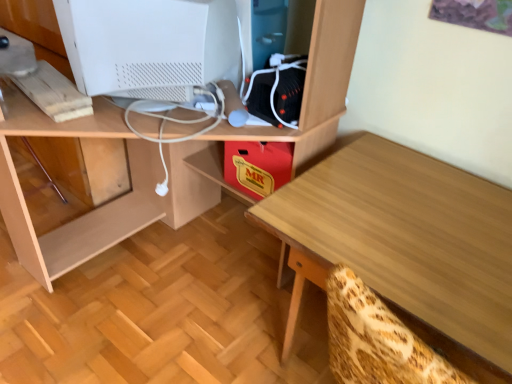
What is the approximate height of light wood table at center?

light wood table at center is 25.61 inches in height.

At what (x,y) coordinates should I click in order to perform the action: click on white matte computer monitor at upper left. Please return your answer as a coordinate pair (x, y). Looking at the image, I should click on (150, 45).

From the image's perspective, relative to light wood table at center, is white matte computer monitor at upper left above or below?

Clearly, from the image's perspective, white matte computer monitor at upper left is above light wood table at center.

Does white matte computer monitor at upper left turn towards light wood table at center?

No, white matte computer monitor at upper left does not turn towards light wood table at center.

How distant is white matte computer monitor at upper left from light wood table at center?

The distance of white matte computer monitor at upper left from light wood table at center is 60.47 centimeters.

In the scene shown: Would you consider white matte computer monitor at upper left to be distant from light wood table at center?

white matte computer monitor at upper left is near light wood table at center, not far away.

How distant is wooden desk at center from white matte computer monitor at upper left?

wooden desk at center is 12.06 inches from white matte computer monitor at upper left.

Consider the image. From the image's perspective, is wooden desk at center above or below white matte computer monitor at upper left?

Clearly, from the image's perspective, wooden desk at center is below white matte computer monitor at upper left.

Relative to white matte computer monitor at upper left, is wooden desk at center in front or behind?

Clearly, wooden desk at center is in front of white matte computer monitor at upper left.

From a real-world perspective, which is physically below, wooden desk at center or white matte computer monitor at upper left?

wooden desk at center, from a real-world perspective.

Which object is wider, light wood table at center or white matte computer monitor at upper left?

light wood table at center.

Is point (426, 340) closer or farther from the camera than point (68, 10)?

Point (426, 340).

In the scene shown: Looking at the image, does light wood table at center seem bigger or smaller compared to white matte computer monitor at upper left?

In the image, light wood table at center appears to be larger than white matte computer monitor at upper left.

What's the angular difference between light wood table at center and white matte computer monitor at upper left's facing directions?

They differ by 75.8 degrees in their facing directions.

From the image's perspective, is white matte computer monitor at upper left above wooden desk at center?

Yes, from the image's perspective, white matte computer monitor at upper left is on top of wooden desk at center.

The width and height of the screenshot is (512, 384). There is a wooden desk at center. Identify the location of computer monitor above it (from a real-world perspective). (150, 45).

Considering the sizes of objects white matte computer monitor at upper left and wooden desk at center in the image provided, who is bigger, white matte computer monitor at upper left or wooden desk at center?

With larger size is wooden desk at center.

Is point (156, 91) farther from viewer compared to point (318, 3)?

Yes, it is behind point (318, 3).

Between light wood table at center and wooden desk at center, which one has less height?

With less height is light wood table at center.

Considering the relative positions of light wood table at center and wooden desk at center in the image provided, is light wood table at center in front of wooden desk at center?

No, it is not.

Find the location of `desk lying in front of the light wood table at center`. desk lying in front of the light wood table at center is located at coordinates (167, 154).

Locate an element on the screen. table on the right of wooden desk at center is located at coordinates (405, 245).

Between wooden desk at center and light wood table at center, which one is positioned behind?

light wood table at center is further away from the camera.

Is wooden desk at center touching light wood table at center?

They are not placed beside each other.

Looking at this image, from a real-world perspective, relative to light wood table at center, is wooden desk at center vertically above or below?

In terms of real-world spatial position, wooden desk at center is above light wood table at center.

You are a GUI agent. You are given a task and a screenshot of the screen. Output one action in this format:
    pyautogui.click(x=<x>, y=<y>)
    Task: Click on the table that appears below the white matte computer monitor at upper left (from the image's perspective)
    The width and height of the screenshot is (512, 384).
    Given the screenshot: What is the action you would take?
    pyautogui.click(x=405, y=245)

Identify the location of computer monitor that is above the wooden desk at center (from a real-world perspective). The image size is (512, 384). (150, 45).

From the image, which object appears to be nearer to wooden desk at center, light wood table at center or white matte computer monitor at upper left?

Based on the image, white matte computer monitor at upper left appears to be nearer to wooden desk at center.

Based on their spatial positions, is white matte computer monitor at upper left or wooden desk at center closer to light wood table at center?

Among the two, wooden desk at center is located nearer to light wood table at center.

In the scene shown: Considering their positions, is light wood table at center positioned closer to white matte computer monitor at upper left than wooden desk at center?

wooden desk at center.

Considering their positions, is wooden desk at center positioned further to white matte computer monitor at upper left than light wood table at center?

light wood table at center is further to white matte computer monitor at upper left.

Which object lies nearer to the anchor point light wood table at center, wooden desk at center or white matte computer monitor at upper left?

Among the two, wooden desk at center is located nearer to light wood table at center.

Estimate the real-world distances between objects in this image. Which object is closer to wooden desk at center, white matte computer monitor at upper left or light wood table at center?

Among the two, white matte computer monitor at upper left is located nearer to wooden desk at center.

At what (x,y) coordinates should I click in order to perform the action: click on desk between white matte computer monitor at upper left and light wood table at center. Please return your answer as a coordinate pair (x, y). The height and width of the screenshot is (384, 512). Looking at the image, I should click on (167, 154).